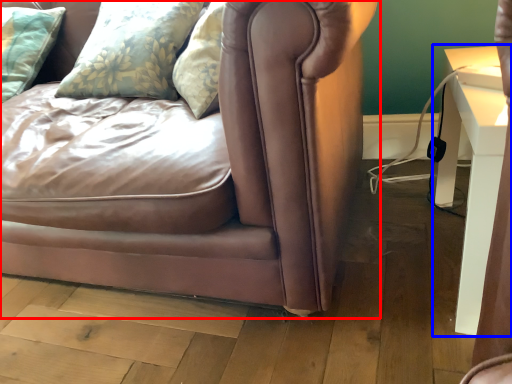
Question: Among these objects, which one is farthest to the camera, studio couch (highlighted by a red box) or table (highlighted by a blue box)?

Choices:
 (A) studio couch
 (B) table

Answer: (B)